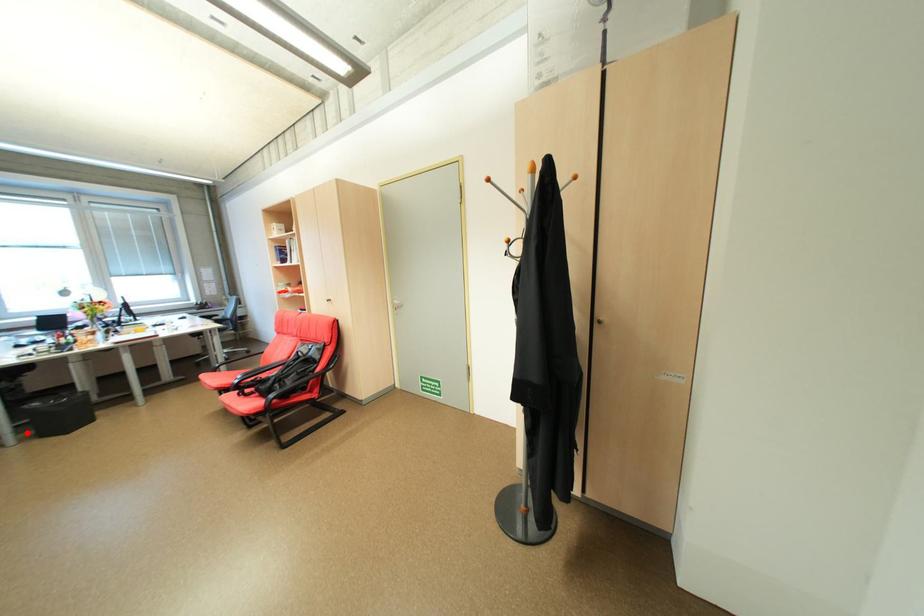
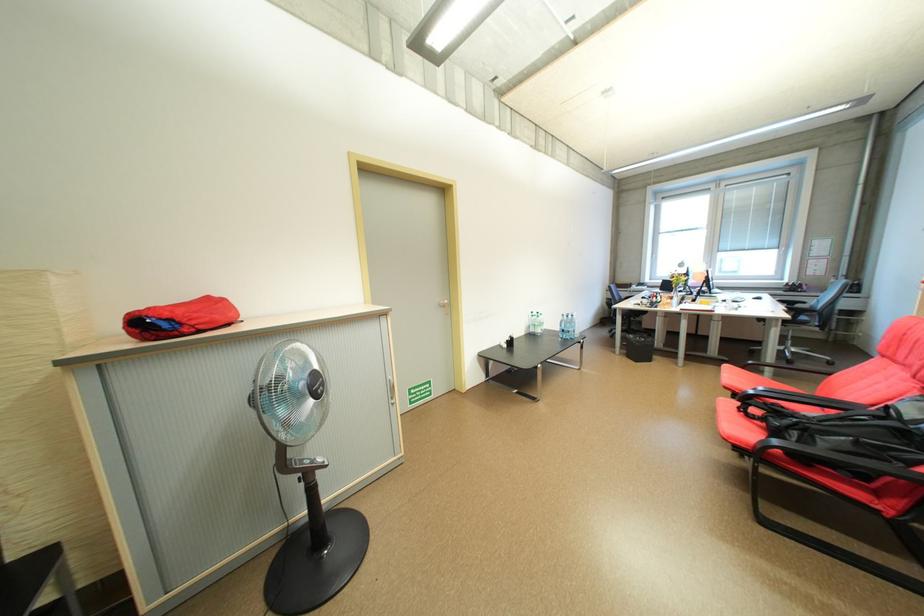
Find the pixel in the second image that matches the highlighted location in the first image.

(630, 349)